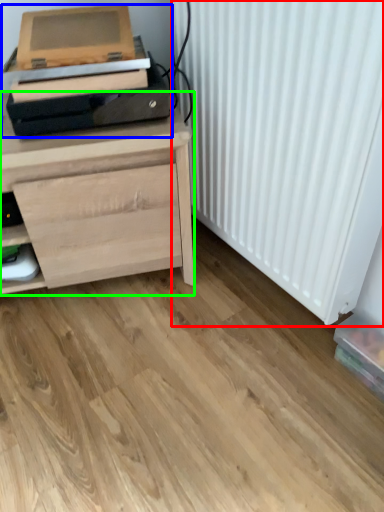
Question: Based on their relative distances, which object is farther from radiator (highlighted by a red box)? Choose from printer (highlighted by a blue box) and chest of drawers (highlighted by a green box).

Choices:
 (A) printer
 (B) chest of drawers

Answer: (A)